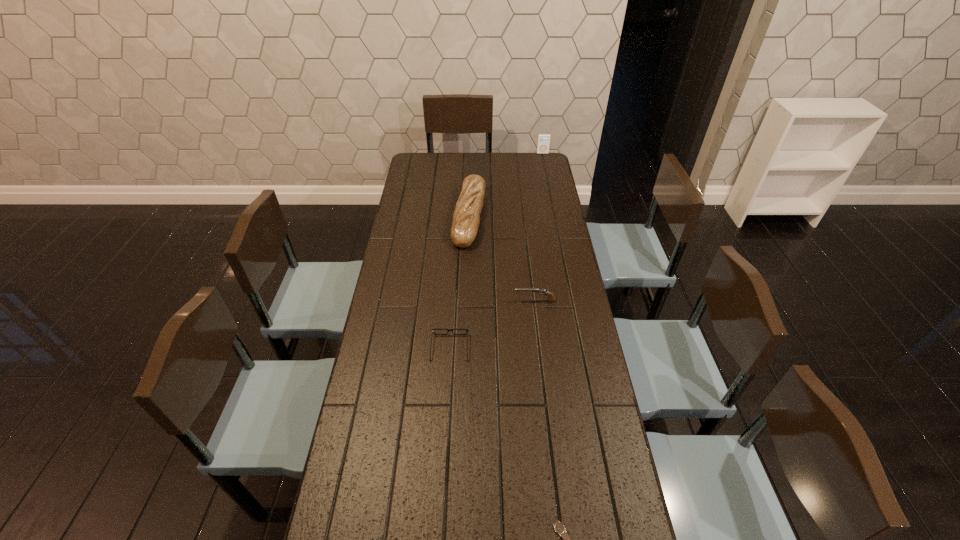
This screenshot has width=960, height=540. I want to click on free space located aiming along the barrel of the gun, so click(x=475, y=301).

This screenshot has width=960, height=540. Identify the location of vacant point located aiming along the barrel of the gun. (403, 301).

At what (x,y) coordinates should I click in order to perform the action: click on vacant region located 0.350m on the front-facing side of the fourth tallest object. Please return your answer as a coordinate pair (x, y). The height and width of the screenshot is (540, 960). Looking at the image, I should click on (455, 264).

Locate an element on the screen. free space located 0.250m on the front-facing side of the fourth tallest object is located at coordinates (454, 282).

The height and width of the screenshot is (540, 960). What are the coordinates of `vacant space located on the front-facing side of the fourth tallest object` in the screenshot? It's located at (452, 314).

Locate an element on the screen. Image resolution: width=960 pixels, height=540 pixels. object present at the far edge is located at coordinates (543, 144).

Locate an element on the screen. This screenshot has height=540, width=960. iPod positioned at the right edge is located at coordinates (543, 144).

Where is `gun that is at the right edge`? gun that is at the right edge is located at coordinates (551, 298).

Where is `object at the far right corner`? object at the far right corner is located at coordinates (543, 144).

The image size is (960, 540). Find the location of `free space at the far edge`. free space at the far edge is located at coordinates (499, 166).